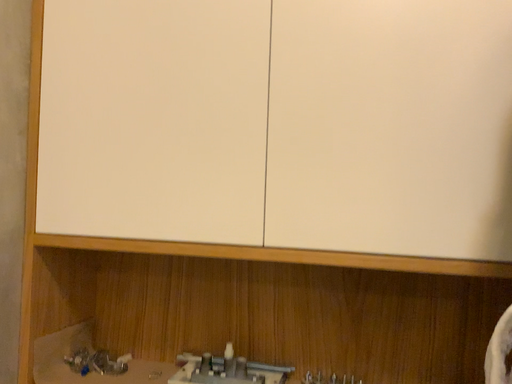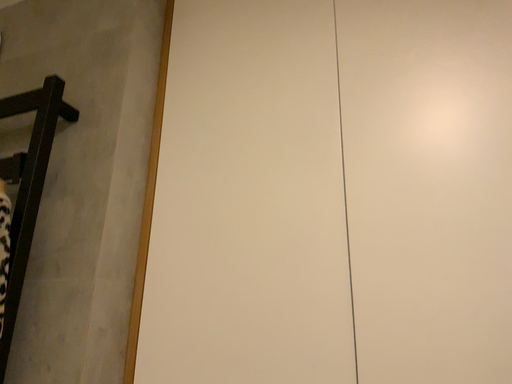
Question: Which way did the camera rotate in the video?

Choices:
 (A) rotated left
 (B) rotated right

Answer: (A)